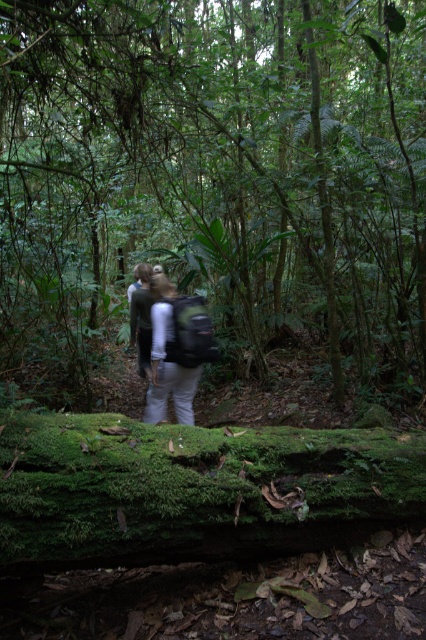
You are a hiker planning to cross the forest path. You see the green mossy log at lower center and the light gray fabric backpack at center. Which object is bigger in size?

The green mossy log at lower center is larger in size than the light gray fabric backpack at center.

You are a hiker in the forest and want to know which point is closer to you. The points are point (187, 256) and point (152, 323). Which one is closer to you?

Point (187, 256) is closer to you than point (152, 323).